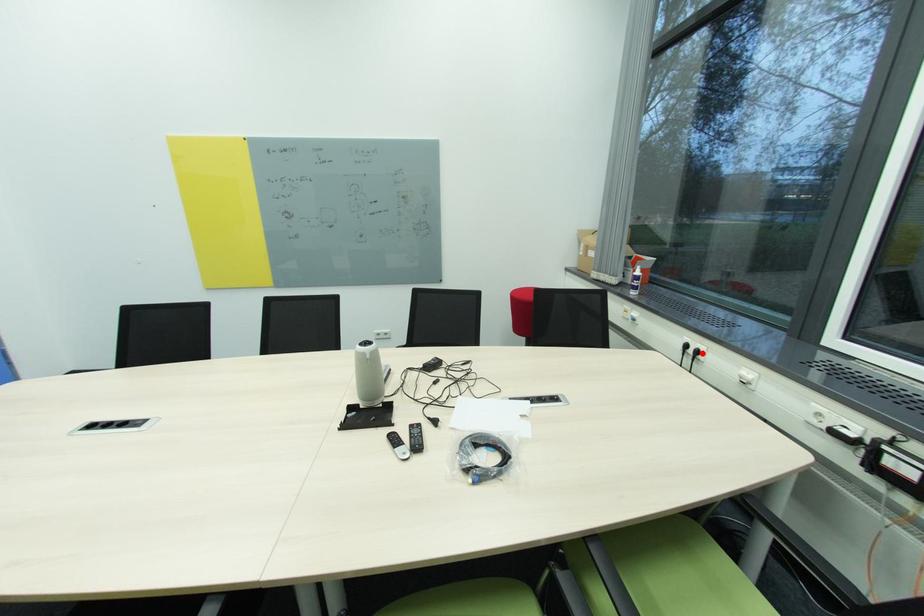
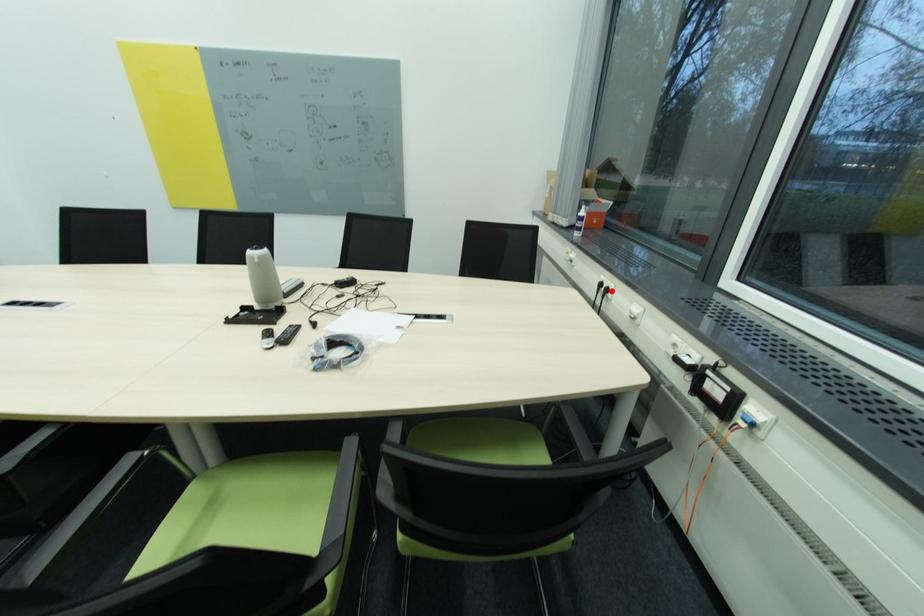
I am providing you with two images of the same scene from different viewpoints. A red point is marked on the first image and another point is marked on the second image. Are the points marked in image1 and image2 representing the same 3D position?

Yes